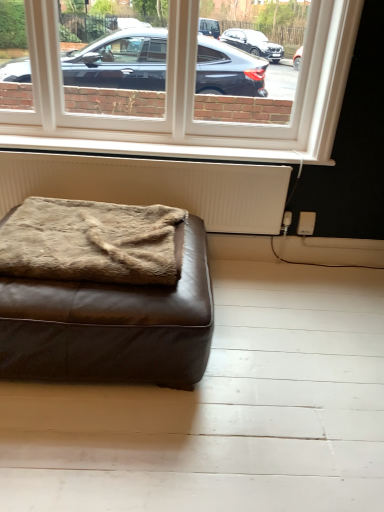
Question: From the image's perspective, is white plastic window at upper center beneath brown leather ottoman at lower left?

Choices:
 (A) yes
 (B) no

Answer: (B)

Question: Is white plastic window at upper center behind brown leather ottoman at lower left?

Choices:
 (A) no
 (B) yes

Answer: (B)

Question: Is white plastic window at upper center thinner than brown leather ottoman at lower left?

Choices:
 (A) no
 (B) yes

Answer: (B)

Question: Is white plastic window at upper center turned away from brown leather ottoman at lower left?

Choices:
 (A) no
 (B) yes

Answer: (A)

Question: Is white plastic window at upper center wider than brown leather ottoman at lower left?

Choices:
 (A) yes
 (B) no

Answer: (B)

Question: Is brown leather ottoman at lower left a part of white plastic window at upper center?

Choices:
 (A) yes
 (B) no

Answer: (B)

Question: From a real-world perspective, is brown fuzzy blanket at lower left located higher than white textured radiator at lower center?

Choices:
 (A) no
 (B) yes

Answer: (B)

Question: Does brown fuzzy blanket at lower left come in front of white textured radiator at lower center?

Choices:
 (A) yes
 (B) no

Answer: (A)

Question: Does brown fuzzy blanket at lower left have a greater width compared to white textured radiator at lower center?

Choices:
 (A) no
 (B) yes

Answer: (B)

Question: From the image's perspective, is brown fuzzy blanket at lower left below white textured radiator at lower center?

Choices:
 (A) yes
 (B) no

Answer: (A)

Question: Is the depth of brown fuzzy blanket at lower left greater than that of white textured radiator at lower center?

Choices:
 (A) no
 (B) yes

Answer: (A)

Question: From a real-world perspective, is brown fuzzy blanket at lower left beneath white textured radiator at lower center?

Choices:
 (A) yes
 (B) no

Answer: (B)

Question: Can you confirm if white painted wood at lower center is positioned to the left of white textured radiator at lower center?

Choices:
 (A) yes
 (B) no

Answer: (B)